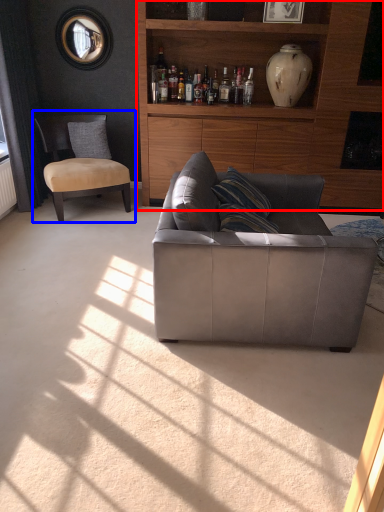
Question: Which object appears closest to the camera in this image, cabinetry (highlighted by a red box) or chair (highlighted by a blue box)?

Choices:
 (A) cabinetry
 (B) chair

Answer: (A)